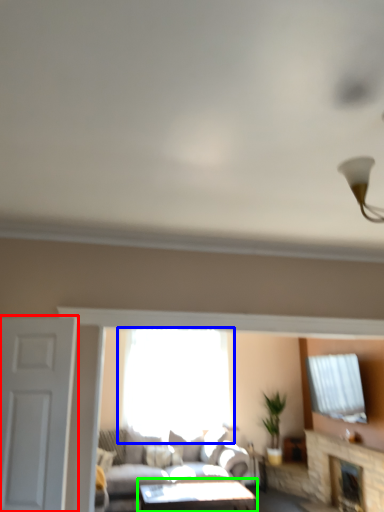
Question: Considering the real-world distances, which object is closest to door (highlighted by a red box)? window (highlighted by a blue box) or table (highlighted by a green box).

Choices:
 (A) window
 (B) table

Answer: (B)